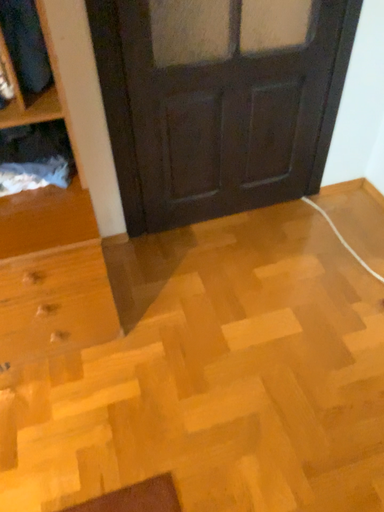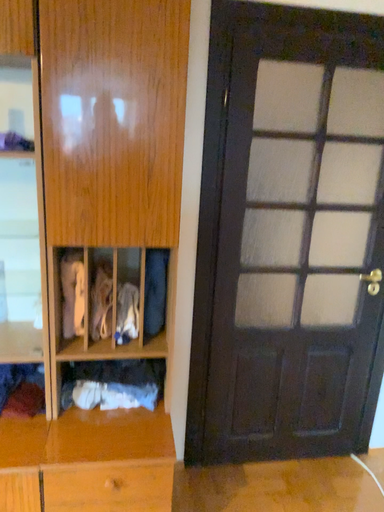
Question: How did the camera likely rotate when shooting the video?

Choices:
 (A) rotated upward
 (B) rotated downward

Answer: (A)